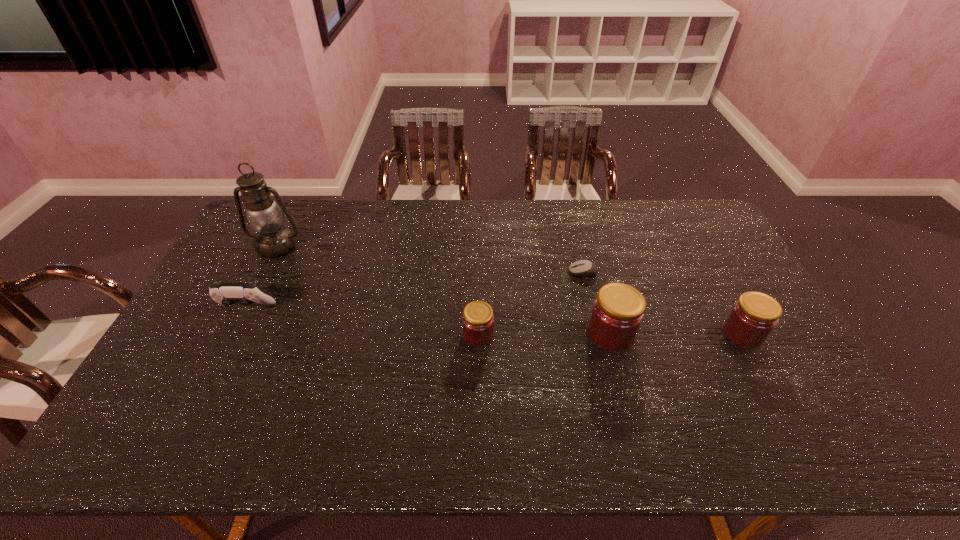
I want to click on the leftmost jam, so click(478, 320).

Identify the location of the fourth object from right to left. (478, 320).

This screenshot has width=960, height=540. I want to click on the second jam from left to right, so (618, 311).

Image resolution: width=960 pixels, height=540 pixels. Identify the location of the tallest jam. (618, 311).

Image resolution: width=960 pixels, height=540 pixels. I want to click on the second shortest jam, so click(753, 317).

Where is `the rightmost jam`? the rightmost jam is located at coordinates (753, 317).

At what (x,y) coordinates should I click in order to perform the action: click on the farthest object. Please return your answer as a coordinate pair (x, y). Looking at the image, I should click on (264, 215).

Image resolution: width=960 pixels, height=540 pixels. Find the location of `the tallest object`. the tallest object is located at coordinates pos(264,215).

Identify the location of computer equipment. This screenshot has height=540, width=960. (583, 267).

I want to click on the shortest object, so click(x=583, y=267).